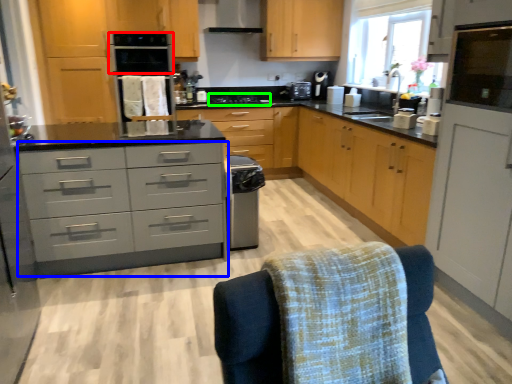
Question: Based on their relative distances, which object is nearer to kitchen appliance (highlighted by a red box)? Choose from chest of drawers (highlighted by a blue box) and stove (highlighted by a green box).

Choices:
 (A) chest of drawers
 (B) stove

Answer: (B)